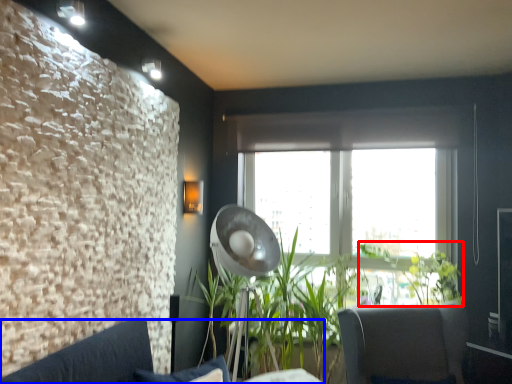
Question: Which point is further to the camera, plant (highlighted by a red box) or studio couch (highlighted by a blue box)?

Choices:
 (A) plant
 (B) studio couch

Answer: (A)